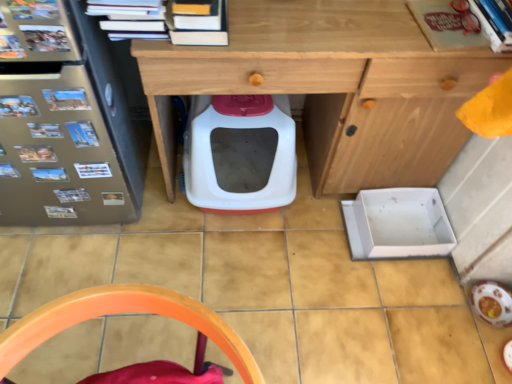
Image resolution: width=512 pixels, height=384 pixels. What are the coordinates of `vacant space that is to the left of matte red book at upper right, which is the 2th book from right to left` in the screenshot? It's located at (380, 25).